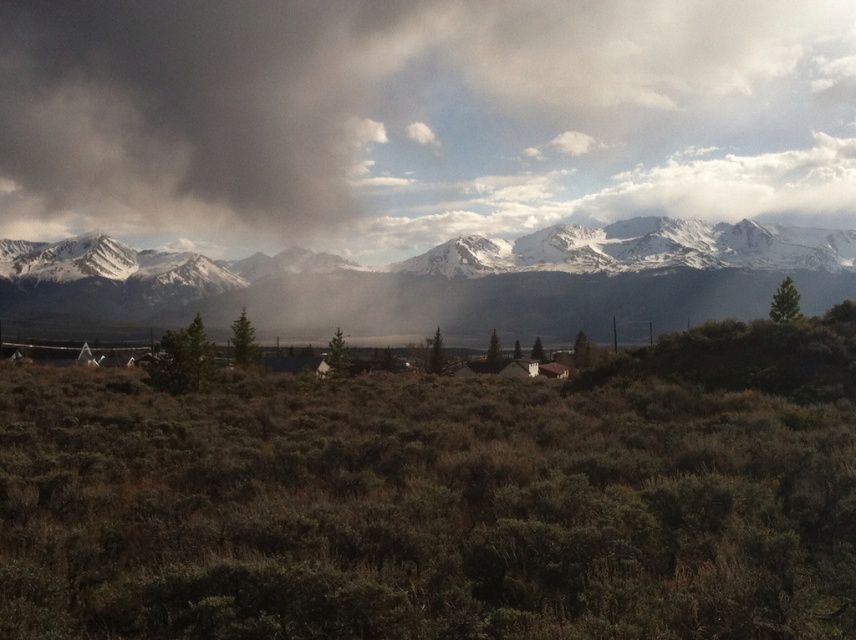
Who is shorter, dark gray cloud at upper center or snowy granite mountain range at upper center?

snowy granite mountain range at upper center is shorter.

Between point (342, 93) and point (43, 292), which one is positioned in front?

Point (43, 292)

Who is more forward, (137, 19) or (635, 252)?

Positioned in front is point (635, 252).

Identify the location of dark gray cloud at upper center. (415, 116).